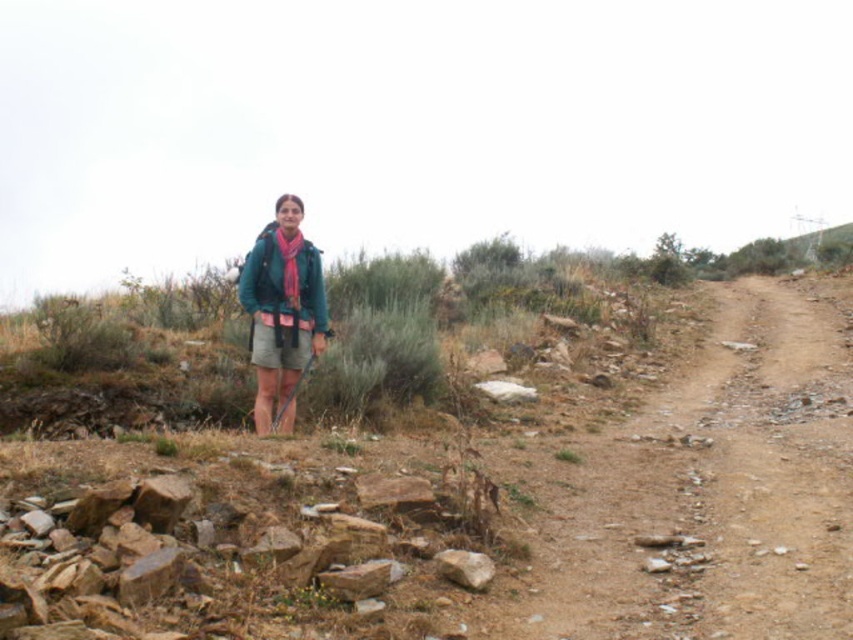
Question: Observing the image, what is the correct spatial positioning of teal fabric jacket at center in reference to teal matte jacket at center?

Choices:
 (A) left
 (B) right

Answer: (A)

Question: Among these objects, which one is nearest to the camera?

Choices:
 (A) teal matte jacket at center
 (B) rusty stone pile at lower left
 (C) teal fabric jacket at center
 (D) gray fabric skirt at center

Answer: (B)

Question: Which of these objects is positioned farthest from the teal matte jacket at center?

Choices:
 (A) rusty stone pile at lower left
 (B) gray fabric skirt at center
 (C) teal fabric jacket at center

Answer: (A)

Question: Is rusty stone pile at lower left thinner than gray fabric skirt at center?

Choices:
 (A) yes
 (B) no

Answer: (B)

Question: Does teal fabric jacket at center have a larger size compared to gray fabric skirt at center?

Choices:
 (A) no
 (B) yes

Answer: (B)

Question: Which object is the closest to the teal fabric jacket at center?

Choices:
 (A) gray fabric skirt at center
 (B) teal matte jacket at center

Answer: (B)